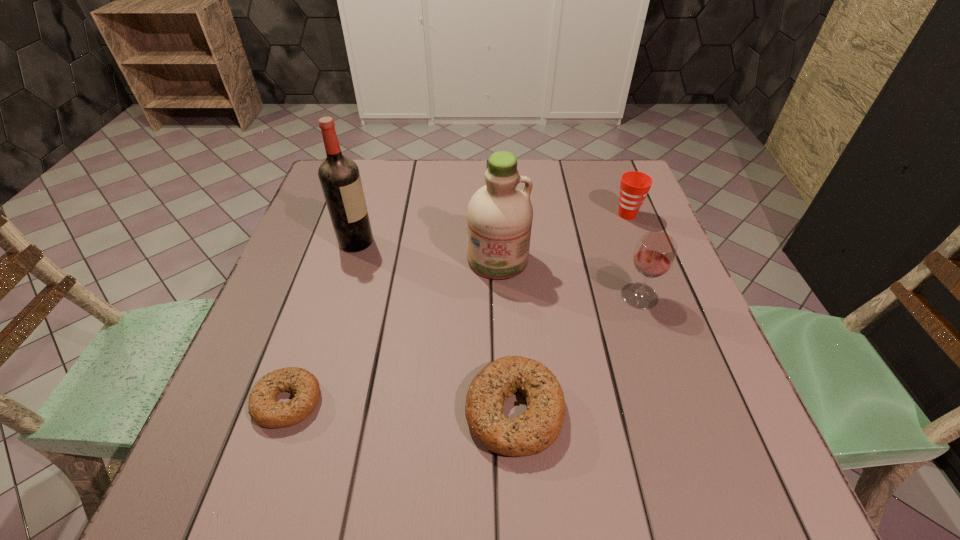
I want to click on vacant position in the image that satisfies the following two spatial constraints: 1. on the front label of the cleansing agent; 2. on the right side of the fourth shortest object, so click(499, 296).

You are a GUI agent. You are given a task and a screenshot of the screen. Output one action in this format:
    pyautogui.click(x=<x>, y=<y>)
    Task: Click on the free space that satisfies the following two spatial constraints: 1. on the front-facing side of the right bagel; 2. on the right side of the liquor
    
    Given the screenshot: What is the action you would take?
    pyautogui.click(x=305, y=410)

This screenshot has width=960, height=540. What are the coordinates of `vacant space that satisfies the following two spatial constraints: 1. on the front-facing side of the taller bagel; 2. on the right side of the liquor` in the screenshot? It's located at (305, 410).